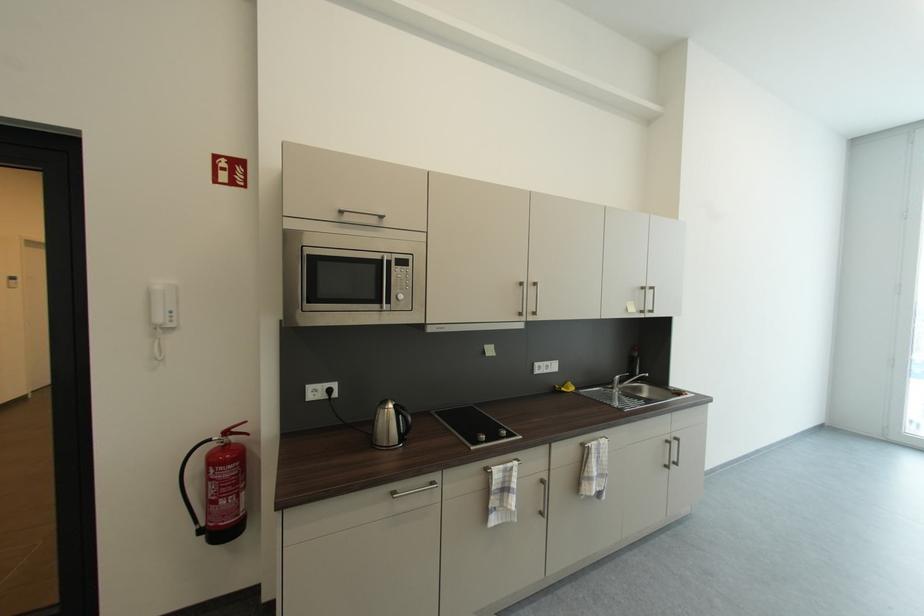
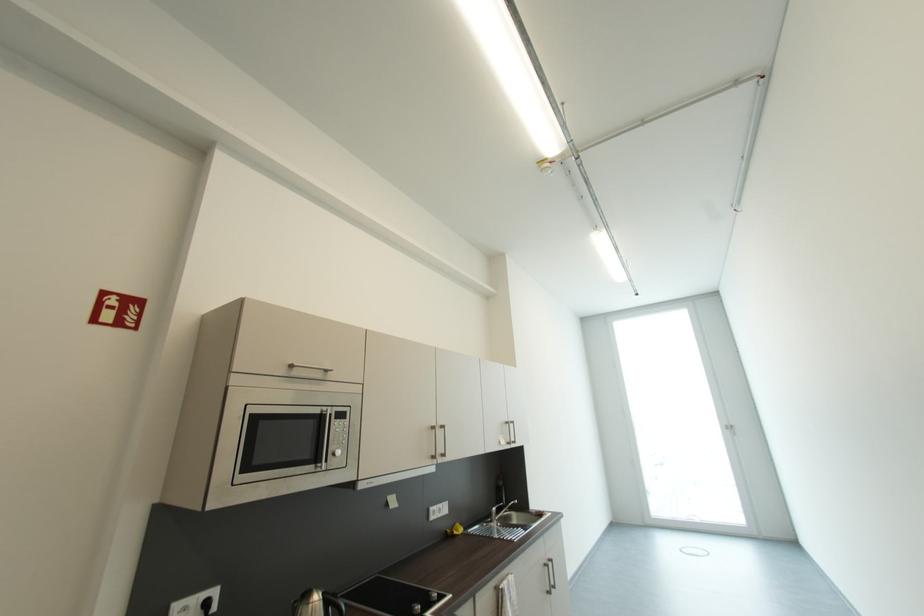
Find the pixel in the second image that matches point 403,261 in the first image.

(342, 413)